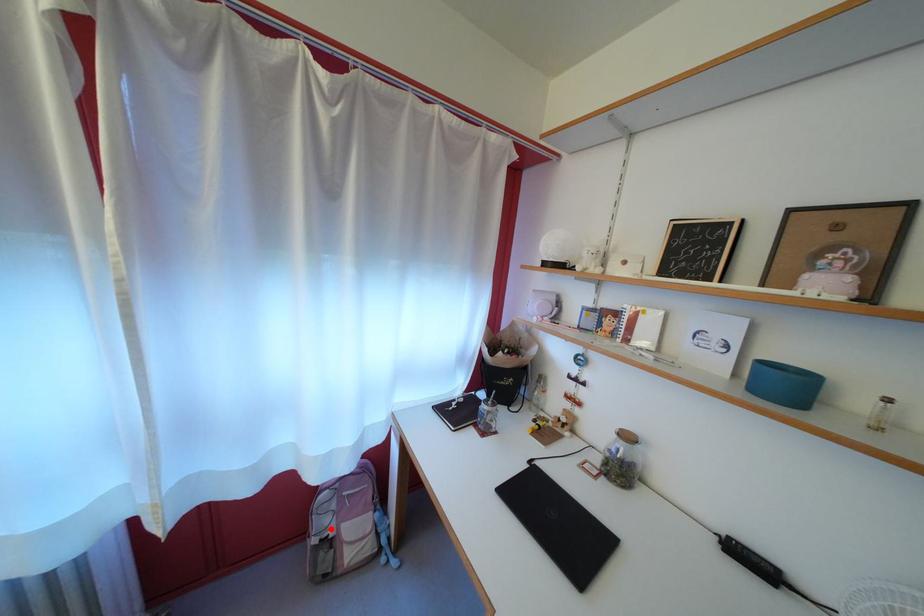
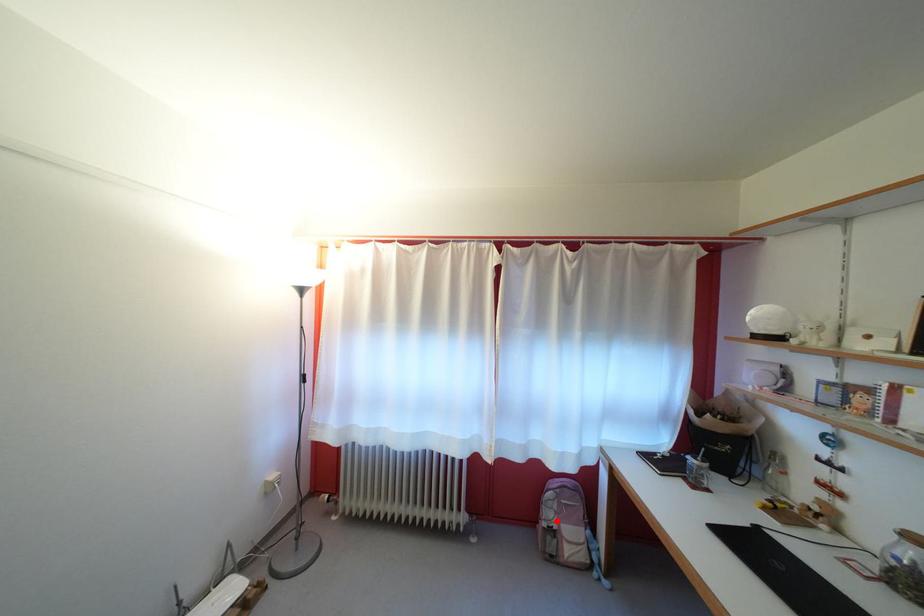
I am providing you with two images of the same scene from different viewpoints. A red point is marked on the first image and another point is marked on the second image. Is the marked point in image1 the same physical position as the marked point in image2?

Yes